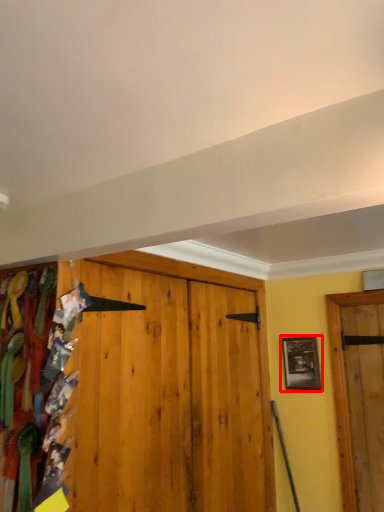
Question: Considering the relative positions of picture frame (annotated by the red box) and textile in the image provided, where is picture frame (annotated by the red box) located with respect to the staircase?

Choices:
 (A) right
 (B) left

Answer: (A)